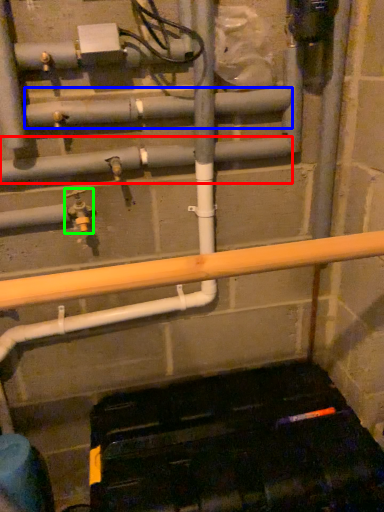
Question: Which is nearer to the pipe (highlighted by a red box)? pipe (highlighted by a blue box) or plumbing fixture (highlighted by a green box).

Choices:
 (A) pipe
 (B) plumbing fixture

Answer: (A)